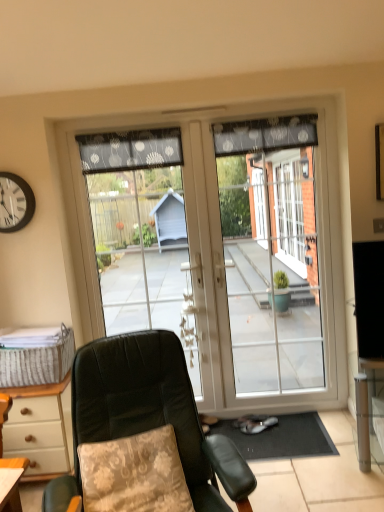
Question: Is floral fabric pillow at lower left taller or shorter than leather-like green chair at center?

Choices:
 (A) short
 (B) tall

Answer: (A)

Question: Is floral fabric pillow at lower left wider or thinner than leather-like green chair at center?

Choices:
 (A) thin
 (B) wide

Answer: (A)

Question: Which of these objects is positioned closest to the black sheer curtain at upper center, which is the first curtain in right-to-left order?

Choices:
 (A) black plastic clock at upper left
 (B) dark gray dotted fabric at upper center, which ranks as the first curtain in left-to-right order
 (C) transparent glass door at center
 (D) transparent glass door at center
 (E) floral fabric pillow at lower left

Answer: (D)

Question: Considering the real-world distances, which object is farthest from the woven beige picnic basket at lower left?

Choices:
 (A) black plastic clock at upper left
 (B) transparent glass door at center
 (C) leather-like green chair at center
 (D) transparent glass door at center
 (E) dark gray dotted fabric at upper center, which ranks as the first curtain in left-to-right order

Answer: (D)